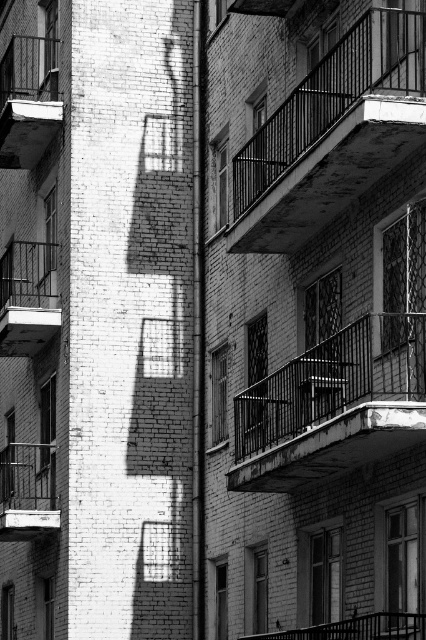
Question: Can you confirm if rusty metal balcony at center is thinner than metallic balcony at lower left?

Choices:
 (A) no
 (B) yes

Answer: (A)

Question: Which of the following is the closest to the observer?

Choices:
 (A) (0, 77)
 (B) (37, 296)
 (C) (238, 481)

Answer: (C)

Question: Which object is farther from the camera taking this photo?

Choices:
 (A) metallic balcony at left
 (B) black metal balcony at left
 (C) rusty metal balcony at upper right

Answer: (A)

Question: Considering the relative positions of rusty metal balcony at center and metallic balcony at lower left in the image provided, where is rusty metal balcony at center located with respect to metallic balcony at lower left?

Choices:
 (A) below
 (B) above

Answer: (B)

Question: Is rusty metal balcony at upper right bigger than black metal balcony at left?

Choices:
 (A) yes
 (B) no

Answer: (A)

Question: Which of these objects is positioned farthest from the metallic balcony at left?

Choices:
 (A) rusty metal balcony at upper right
 (B) rusty metal balcony at center

Answer: (B)